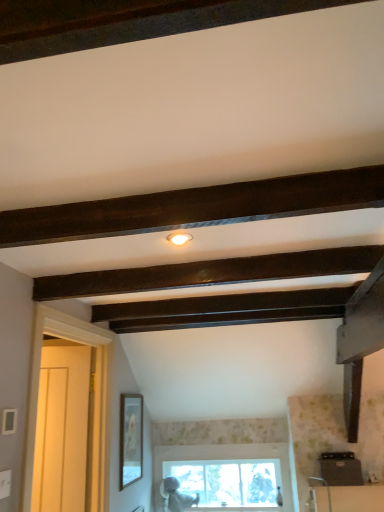
I want to click on clear glass window at center, so click(224, 458).

What do you see at coordinates (224, 458) in the screenshot? Image resolution: width=384 pixels, height=512 pixels. I see `clear glass window at center` at bounding box center [224, 458].

Find the location of `clear glass window at center`. clear glass window at center is located at coordinates (224, 458).